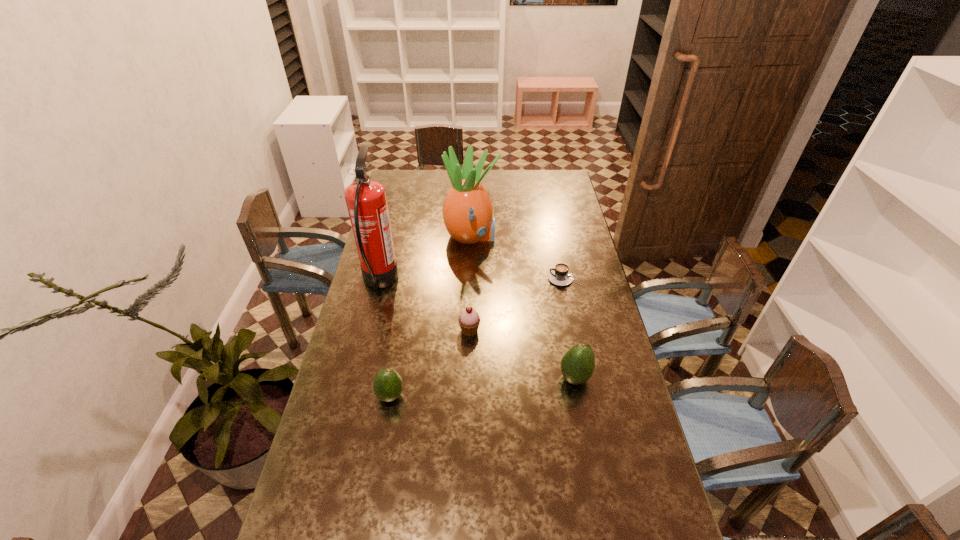
The width and height of the screenshot is (960, 540). I want to click on avocado located at the right edge, so click(x=577, y=364).

You are a GUI agent. You are given a task and a screenshot of the screen. Output one action in this format:
    pyautogui.click(x=<x>, y=<y>)
    Task: Click on the cappuccino located in the right edge section of the desktop
    The height and width of the screenshot is (540, 960).
    Given the screenshot: What is the action you would take?
    pyautogui.click(x=560, y=276)

In the image, there is a desktop. Identify the location of vacant space at the far edge. (538, 190).

The width and height of the screenshot is (960, 540). I want to click on vacant space at the near edge of the desktop, so (543, 528).

What are the coordinates of `free space at the left edge of the desktop` in the screenshot? It's located at (406, 201).

Find the location of a particular element. vacant space at the right edge is located at coordinates (603, 412).

Where is `vacant space at the far right corner`? The width and height of the screenshot is (960, 540). vacant space at the far right corner is located at coordinates (562, 179).

Find the location of a particular element. The image size is (960, 540). vacant space at the near right corner of the desktop is located at coordinates (661, 521).

Find the location of `free space between the pineapple and the fire extinguisher`. free space between the pineapple and the fire extinguisher is located at coordinates (x=425, y=259).

You are a GUI agent. You are given a task and a screenshot of the screen. Output one action in this format:
    pyautogui.click(x=<x>, y=<y>)
    Task: Click on the vacant space that is in between the leftmost object and the cappuccino
    The width and height of the screenshot is (960, 540).
    Given the screenshot: What is the action you would take?
    pyautogui.click(x=472, y=280)